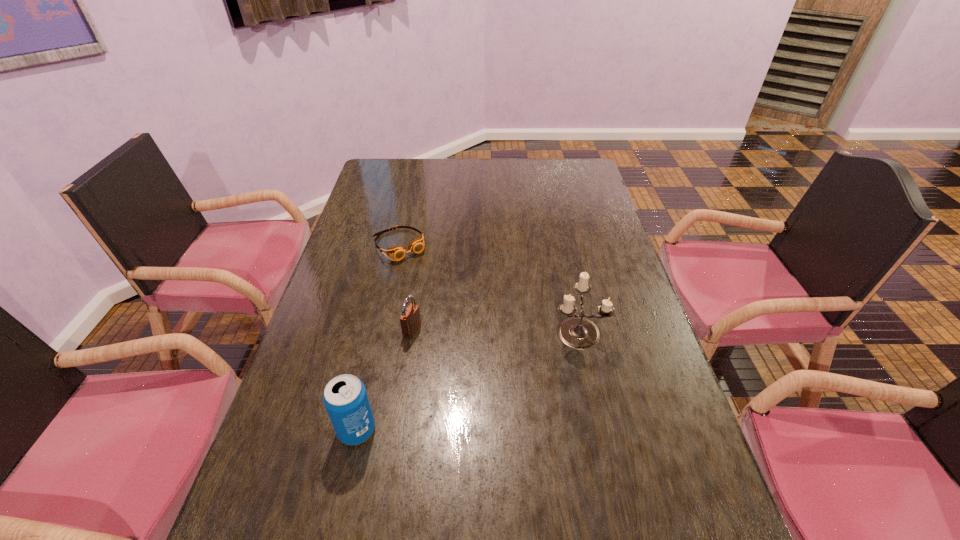
The height and width of the screenshot is (540, 960). What are the coordinates of `free space located 0.380m with the lenses facing forward on the shortest object` in the screenshot? It's located at (473, 341).

Locate an element on the screen. vacant region located 0.070m with the lenses facing forward on the shortest object is located at coordinates (420, 273).

At what (x,y) coordinates should I click in order to perform the action: click on free space located 0.330m with the lenses facing forward on the shortest object. Please return your answer as a coordinate pair (x, y). Looking at the image, I should click on (464, 329).

You are a GUI agent. You are given a task and a screenshot of the screen. Output one action in this format:
    pyautogui.click(x=<x>, y=<y>)
    Task: Click on the soda can that is positioned at the left edge
    
    Given the screenshot: What is the action you would take?
    pyautogui.click(x=345, y=397)

This screenshot has width=960, height=540. I want to click on goggles that is positioned at the left edge, so click(x=417, y=245).

Image resolution: width=960 pixels, height=540 pixels. What are the coordinates of `object that is at the right edge` in the screenshot? It's located at (576, 332).

This screenshot has height=540, width=960. In the image, there is a desktop. What are the coordinates of `vacant space at the far edge` in the screenshot? It's located at (518, 177).

The width and height of the screenshot is (960, 540). What are the coordinates of `free spot at the left edge of the desktop` in the screenshot? It's located at (370, 238).

Image resolution: width=960 pixels, height=540 pixels. In order to click on vacant region at the far left corner of the desktop in this screenshot , I will do `click(385, 167)`.

At what (x,y) coordinates should I click in order to perform the action: click on vacant space at the far right corner of the desktop. Please return your answer as a coordinate pair (x, y). Looking at the image, I should click on [x=567, y=170].